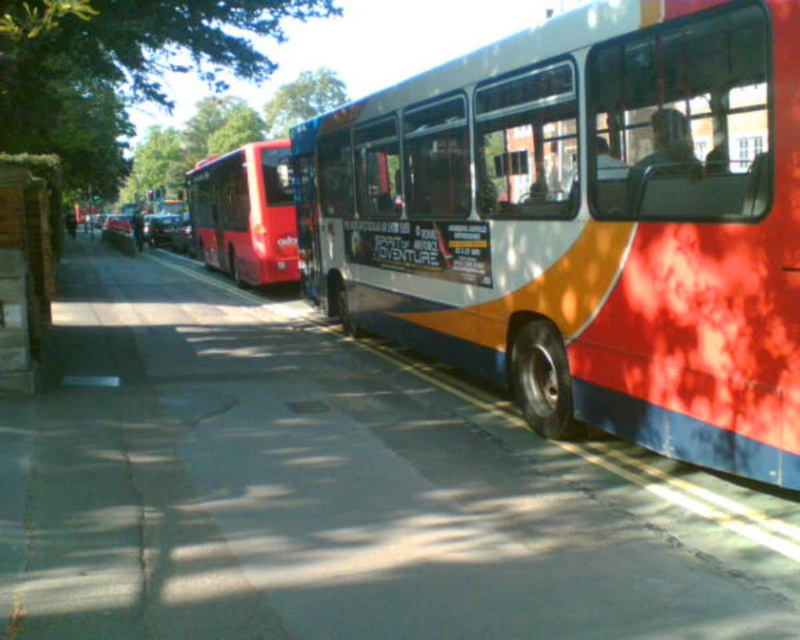
You are a delivery person trying to park your van between the shiny red bus at center and the wooden post at left. Can you fit your van, which is 2 meters wide, in the space between them?

The shiny red bus at center might be wider than wooden post at left, so the space between them may not be wide enough for your 2 meter wide van. Check the actual width before attempting to park.

You are a photographer standing on the sidewalk. You want to take a photo of the shiny red bus at center and the green leafy tree at upper center. Which object will appear narrower in the photo?

The shiny red bus at center will appear narrower in the photo because it is thinner than the green leafy tree at upper center.